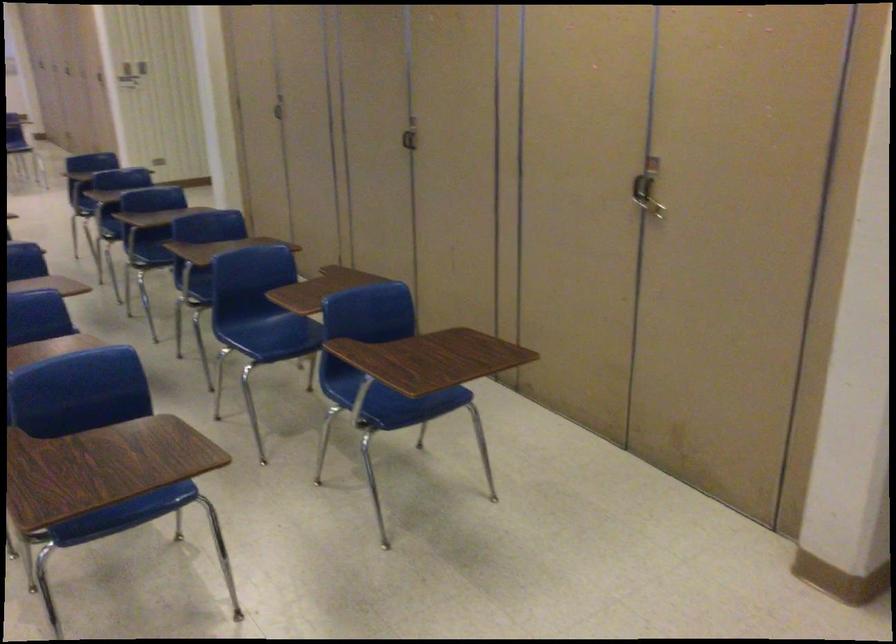
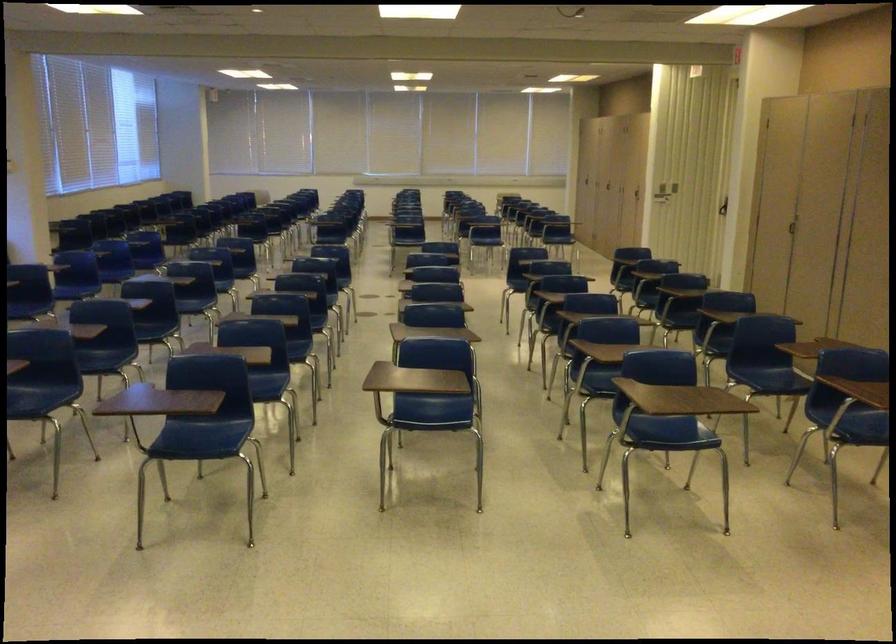
Find the pixel in the second image that matches pixel 280 120 in the first image.

(794, 228)